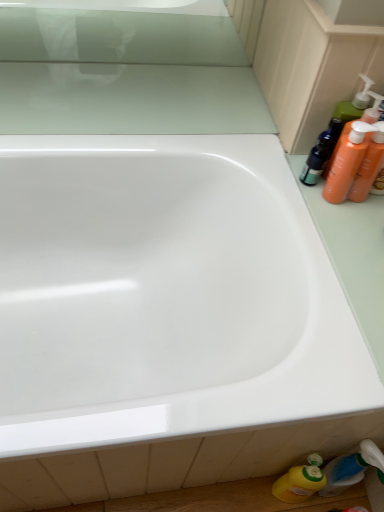
Question: Is translucent plastic bottle at lower right, which ranks as the 3th toiletry in top-to-bottom order, at the left side of orange plastic bottles at upper right, positioned as the 2th cleaning product in bottom-to-top order?

Choices:
 (A) no
 (B) yes

Answer: (A)

Question: Is translucent plastic bottle at lower right, which ranks as the 3th toiletry in top-to-bottom order, oriented away from orange plastic bottles at upper right, marked as the 1th cleaning product in a right-to-left arrangement?

Choices:
 (A) no
 (B) yes

Answer: (A)

Question: Is translucent plastic bottle at lower right, which ranks as the 3th toiletry in top-to-bottom order, behind orange plastic bottles at upper right, positioned as the 2th cleaning product in bottom-to-top order?

Choices:
 (A) yes
 (B) no

Answer: (A)

Question: From the image's perspective, would you say translucent plastic bottle at lower right, the 1th toiletry from the bottom, is positioned over orange plastic bottles at upper right, marked as the second cleaning product in a left-to-right arrangement?

Choices:
 (A) no
 (B) yes

Answer: (A)

Question: From the image's perspective, is translucent plastic bottle at lower right, the 1th toiletry from the bottom, under orange plastic bottles at upper right, the first cleaning product positioned from the top?

Choices:
 (A) yes
 (B) no

Answer: (A)

Question: In the image, is orange plastic bottles at upper right, the 1th toiletry from the top, positioned in front of or behind orange plastic bottles at upper right, the first cleaning product positioned from the top?

Choices:
 (A) front
 (B) behind

Answer: (B)

Question: Considering the positions of orange plastic bottles at upper right, the third toiletry when ordered from bottom to top, and orange plastic bottles at upper right, the first cleaning product positioned from the top, in the image, is orange plastic bottles at upper right, the third toiletry when ordered from bottom to top, taller or shorter than orange plastic bottles at upper right, the first cleaning product positioned from the top,?

Choices:
 (A) short
 (B) tall

Answer: (B)

Question: From a real-world perspective, relative to orange plastic bottles at upper right, marked as the 1th cleaning product in a right-to-left arrangement, is orange plastic bottles at upper right, the 1th toiletry from the top, vertically above or below?

Choices:
 (A) below
 (B) above

Answer: (B)

Question: Considering the positions of point pos(365,110) and point pos(354,122), is point pos(365,110) closer or farther from the camera than point pos(354,122)?

Choices:
 (A) farther
 (B) closer

Answer: (A)

Question: From a real-world perspective, relative to yellow plastic bottle at lower right, acting as the second cleaning product starting from the top, is white glossy bathtub at center vertically above or below?

Choices:
 (A) above
 (B) below

Answer: (A)

Question: From the image's perspective, is white glossy bathtub at center positioned above or below yellow plastic bottle at lower right, which appears as the first cleaning product when ordered from the bottom?

Choices:
 (A) above
 (B) below

Answer: (A)

Question: Relative to yellow plastic bottle at lower right, acting as the second cleaning product starting from the right, is white glossy bathtub at center in front or behind?

Choices:
 (A) behind
 (B) front

Answer: (B)

Question: Would you say white glossy bathtub at center is to the left or to the right of yellow plastic bottle at lower right, acting as the second cleaning product starting from the right, in the picture?

Choices:
 (A) left
 (B) right

Answer: (A)

Question: Relative to orange plastic bottles at right, which ranks as the second toiletry in bottom-to-top order, is yellow plastic bottle at lower right, which appears as the first cleaning product when ordered from the bottom, in front or behind?

Choices:
 (A) behind
 (B) front

Answer: (A)

Question: Does point (292, 494) appear closer or farther from the camera than point (372, 125)?

Choices:
 (A) closer
 (B) farther

Answer: (B)